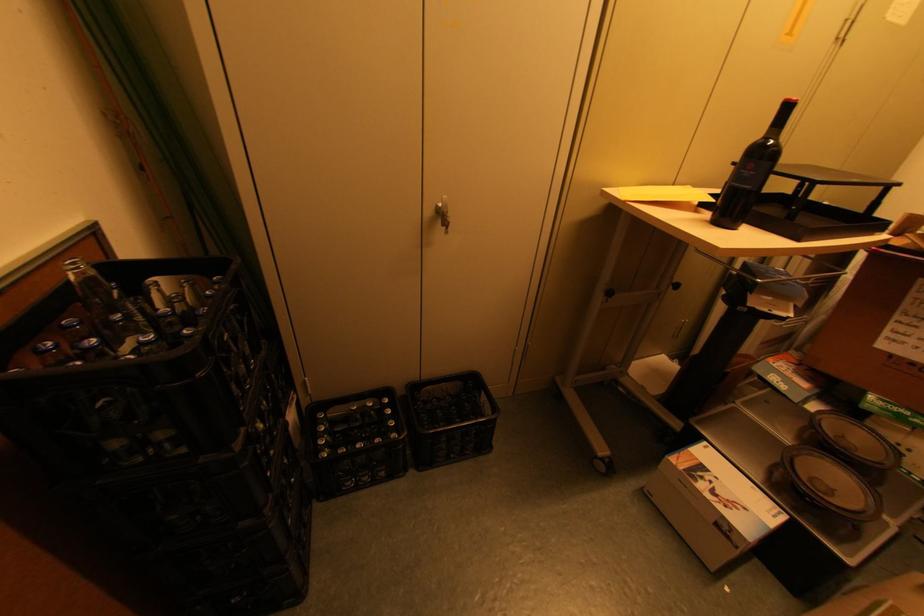
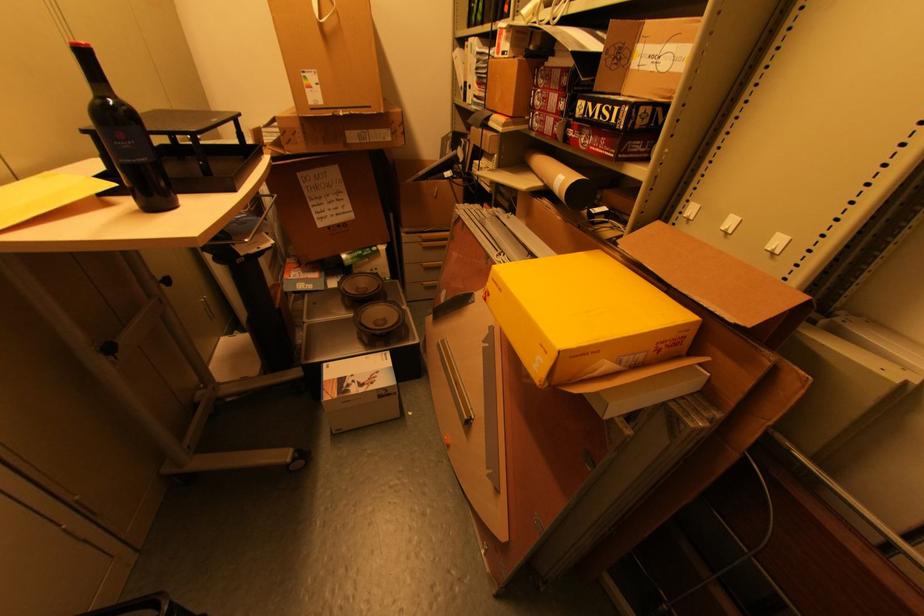
The point at [613,294] is marked in the first image. Where is the corresponding point in the second image?

(114, 349)